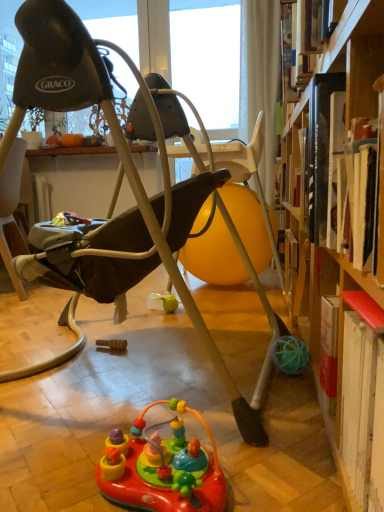
Question: Is matte black swing at center behind multicolored plastic toy at center?

Choices:
 (A) yes
 (B) no

Answer: (A)

Question: From the image's perspective, would you say matte black swing at center is shown under multicolored plastic toy at center?

Choices:
 (A) no
 (B) yes

Answer: (A)

Question: Is matte black swing at center not close to multicolored plastic toy at center?

Choices:
 (A) no
 (B) yes

Answer: (A)

Question: Could you tell me if matte black swing at center is facing multicolored plastic toy at center?

Choices:
 (A) no
 (B) yes

Answer: (A)

Question: Considering the relative sizes of matte black swing at center and multicolored plastic toy at center in the image provided, is matte black swing at center shorter than multicolored plastic toy at center?

Choices:
 (A) no
 (B) yes

Answer: (A)

Question: Can we say matte black swing at center lies outside multicolored plastic toy at center?

Choices:
 (A) no
 (B) yes

Answer: (B)

Question: Considering the relative sizes of multicolored plastic toy at center and matte black swing at center in the image provided, is multicolored plastic toy at center wider than matte black swing at center?

Choices:
 (A) no
 (B) yes

Answer: (A)

Question: From a real-world perspective, is multicolored plastic toy at center on top of matte black swing at center?

Choices:
 (A) no
 (B) yes

Answer: (A)

Question: Would you say matte black swing at center is part of multicolored plastic toy at center's contents?

Choices:
 (A) yes
 (B) no

Answer: (B)

Question: Is multicolored plastic toy at center not within matte black swing at center?

Choices:
 (A) no
 (B) yes

Answer: (B)

Question: Are multicolored plastic toy at center and matte black swing at center beside each other?

Choices:
 (A) no
 (B) yes

Answer: (A)

Question: Is multicolored plastic toy at center not close to matte black swing at center?

Choices:
 (A) no
 (B) yes

Answer: (A)

Question: From the image's perspective, is multicolored plastic toy at center located above or below matte black swing at center?

Choices:
 (A) below
 (B) above

Answer: (A)